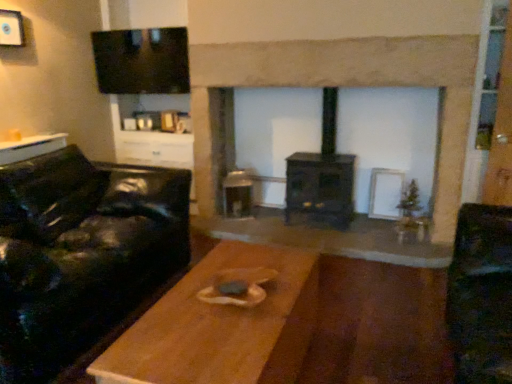
At what (x,y) coordinates should I click in order to perform the action: click on empty space that is ontop of wooden table at center, the 2th table viewed from the left (from a real-world perspective). Please return your answer as a coordinate pair (x, y). Looking at the image, I should click on (214, 320).